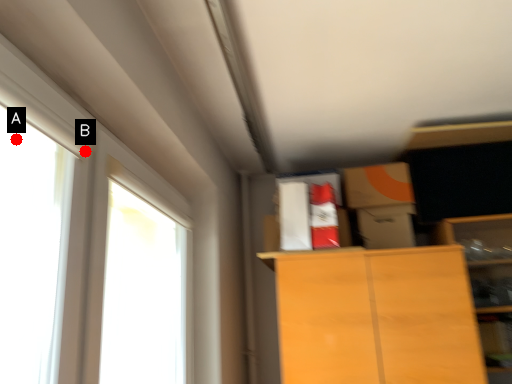
Question: Two points are circled on the image, labeled by A and B beside each circle. Which point is farther to the camera?

Choices:
 (A) A is further
 (B) B is further

Answer: (A)